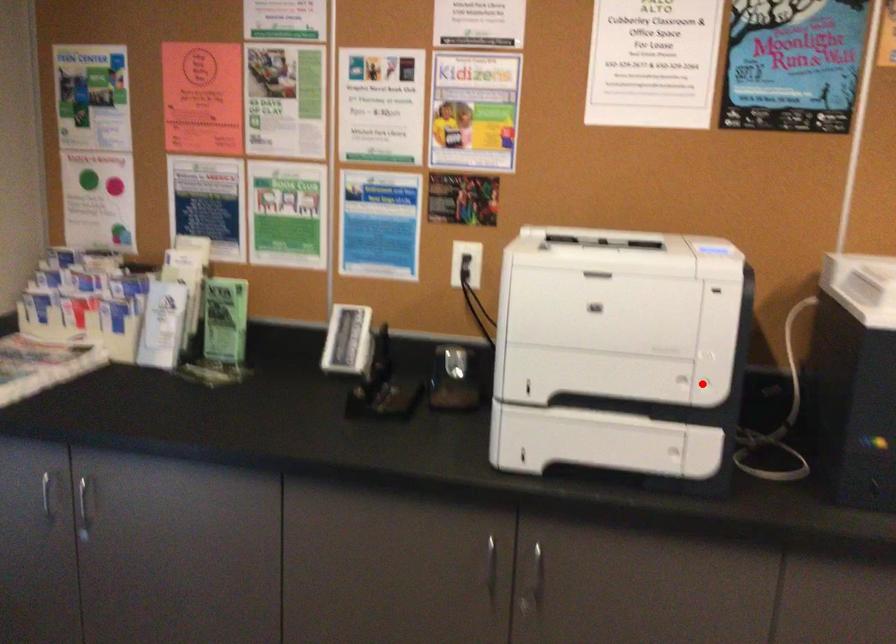
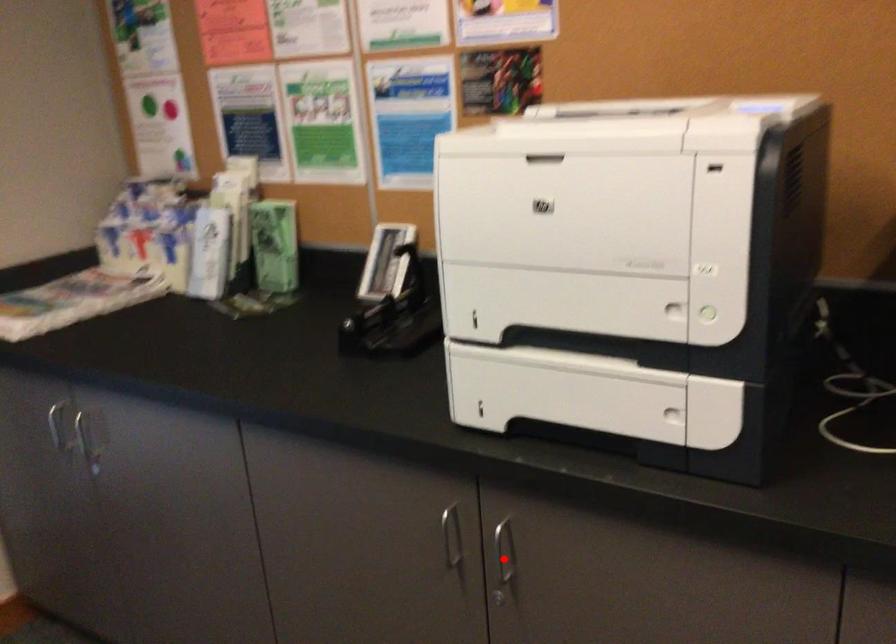
I am providing you with two images of the same scene from different viewpoints. A red point is marked on the first image and another point is marked on the second image. Do the highlighted points in image1 and image2 indicate the same real-world spot?

No